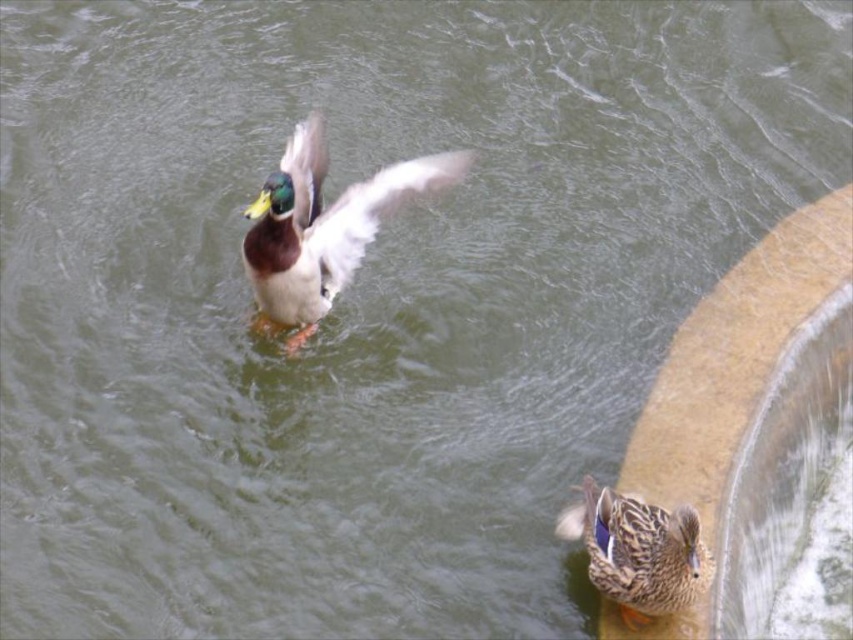
Question: Which of the following is the farthest from the observer?

Choices:
 (A) (624, 596)
 (B) (320, 202)

Answer: (B)

Question: Can you confirm if shiny green duck at upper center is positioned to the left of brown speckled feathers at lower right?

Choices:
 (A) yes
 (B) no

Answer: (A)

Question: Does shiny green duck at upper center come behind brown speckled feathers at lower right?

Choices:
 (A) no
 (B) yes

Answer: (B)

Question: Does shiny green duck at upper center have a lesser width compared to brown speckled feathers at lower right?

Choices:
 (A) yes
 (B) no

Answer: (B)